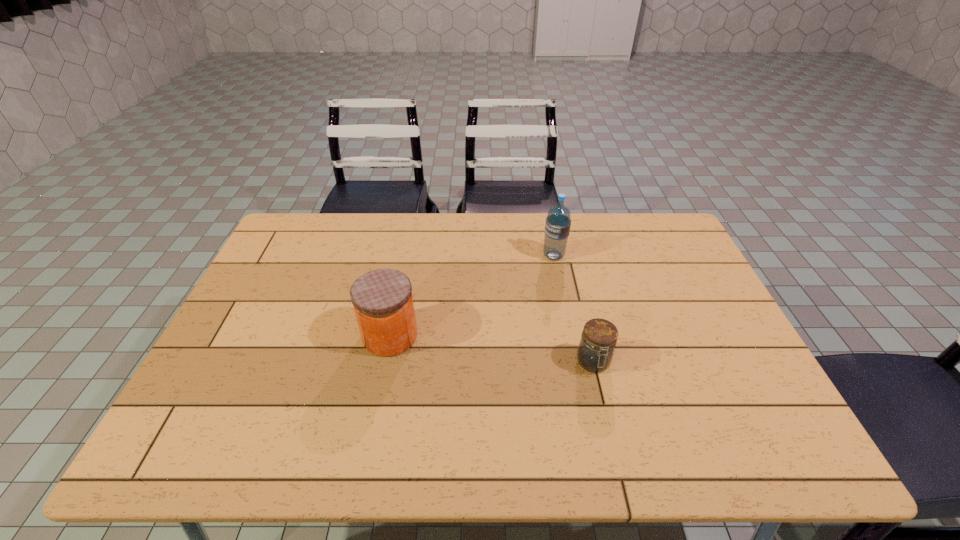
Locate an element on the screen. vacant space that satisfies the following two spatial constraints: 1. on the back side of the taller jar; 2. on the left side of the farthest object is located at coordinates point(406,256).